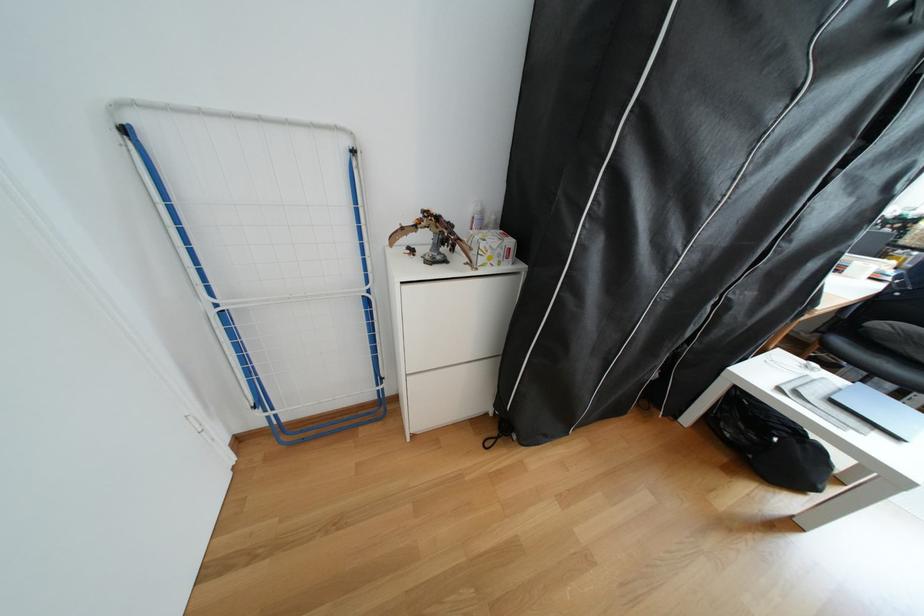
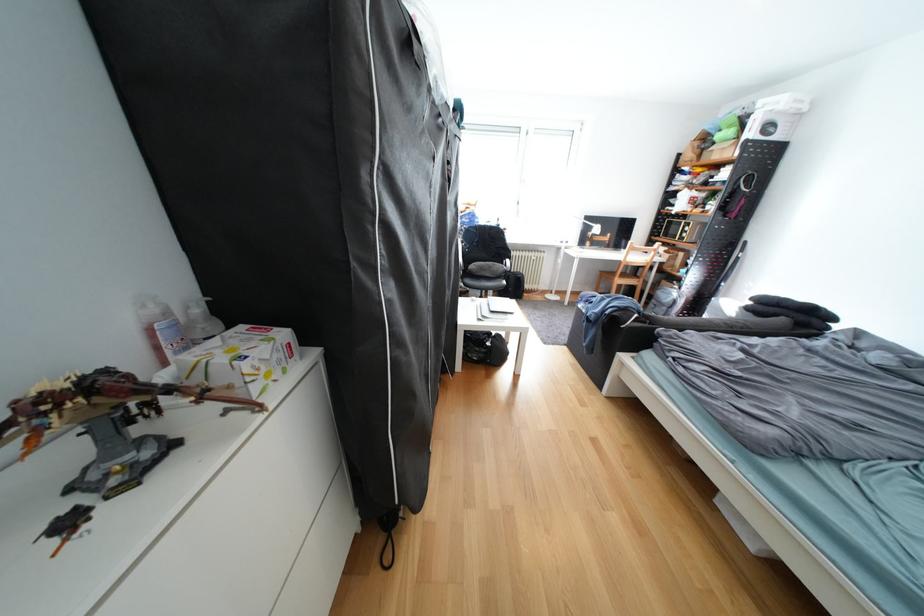
Question: The camera is either moving clockwise (left) or counter-clockwise (right) around the object. The first image is from the beginning of the video and the second image is from the end. Is the camera moving left or right when shooting the video?

Choices:
 (A) Left
 (B) Right

Answer: (A)